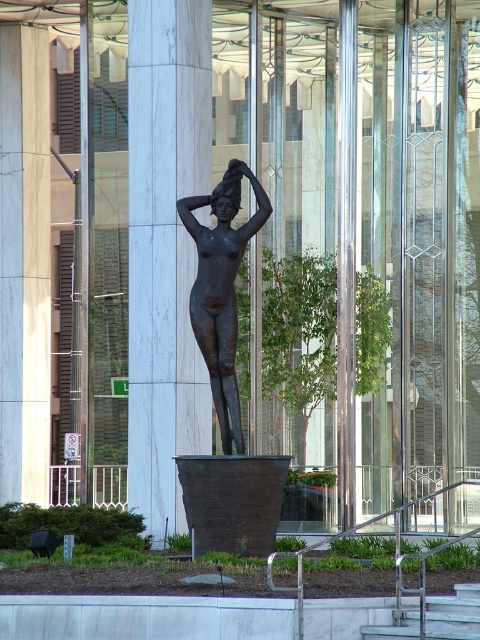
You are an architect designing a new building and want to ensure accessibility. You observe the matte white column at center and the metallic gray stairs at lower center in the image. Which object is taller, and how does this affect the placement of safety railings?

The matte white column at center is taller than the metallic gray stairs at lower center. This means safety railings should be placed around the column to ensure visibility and prevent collisions, while the stairs may require shorter railings or handrails based on standard safety guidelines.

You are an architect reviewing the layout of the modern building. You notice the matte white column at center in the image. Can you determine its exact coordinates in the scene?

The matte white column at center is located at coordinates point (165, 248).

You are standing in front of a modern architectural setting with tall glass panels and reflective surfaces. You see a bronze statue of a nude female figure standing upright. The statue is mounted on a large, dark, cylindrical pedestal that resembles a planter or pot. The statue is at point (222, 289). If you want to take a photo of the statue without any reflections from the glass panels, where should you position yourself relative to the statue?

The bronze statue at center is located at point (222, 289). To avoid reflections from the glass panels, position yourself directly in front of the statue at point (222, 289) where the reflective surfaces are less obstructive.